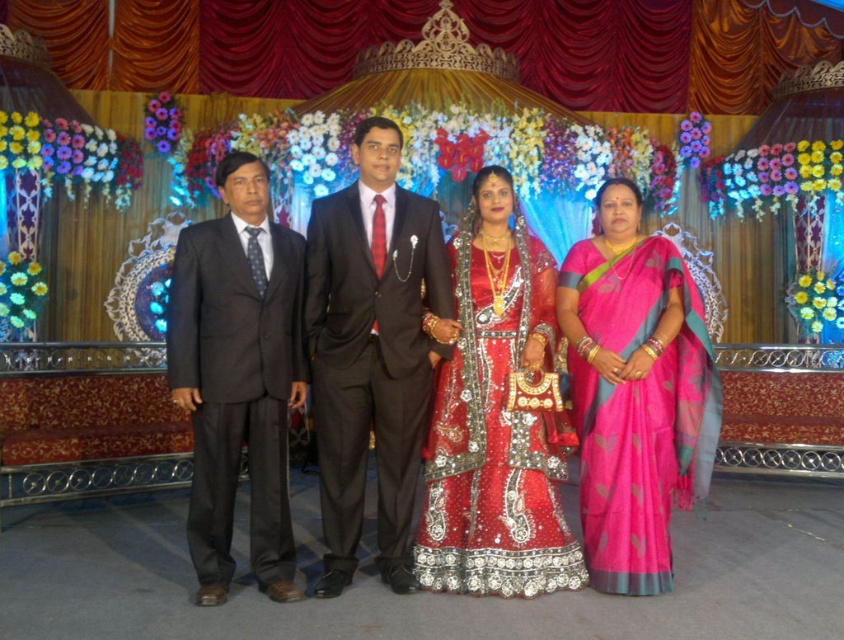
Is dark gray suit at left above red sequined lehenga at center?

Correct, dark gray suit at left is located above red sequined lehenga at center.

From the picture: Can you confirm if dark gray suit at left is taller than red sequined lehenga at center?

Indeed, dark gray suit at left has a greater height compared to red sequined lehenga at center.

Who is more forward, [230,252] or [529,544]?

Point [529,544] is more forward.

Where is `dark gray suit at left`? dark gray suit at left is located at coordinates (x=237, y=376).

Does shiny black suit at center have a greater width compared to pink silk saree at right?

In fact, shiny black suit at center might be narrower than pink silk saree at right.

Between shiny black suit at center and pink silk saree at right, which one has less height?

Standing shorter between the two is pink silk saree at right.

Image resolution: width=844 pixels, height=640 pixels. I want to click on shiny black suit at center, so click(372, 349).

Is the position of shiny red dress at center more distant than that of dark gray suit at left?

No, it is not.

Which is more to the right, shiny red dress at center or dark gray suit at left?

shiny red dress at center is more to the right.

I want to click on shiny red dress at center, so click(x=437, y=380).